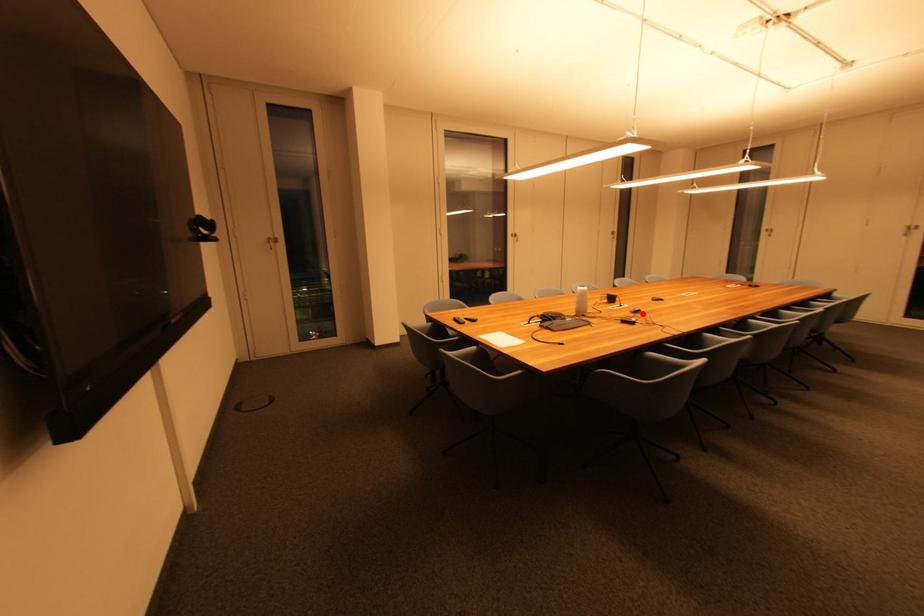
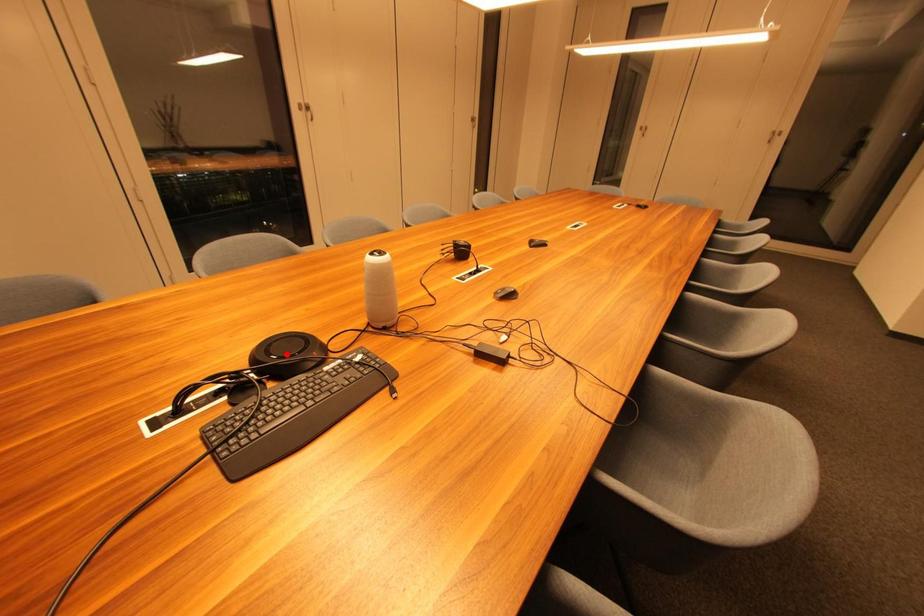
I am providing you with two images of the same scene from different viewpoints. A red point is marked on the first image and another point is marked on the second image. Does the point marked in image1 correspond to the same location as the one in image2?

No